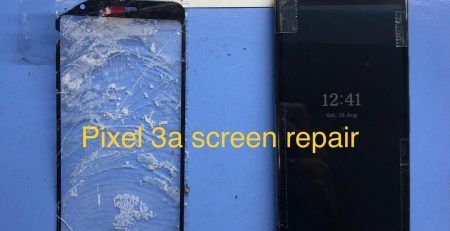
You are a GUI agent. You are given a task and a screenshot of the screen. Output one action in this format:
    pyautogui.click(x=<x>, y=<y>)
    Task: Click on the phone screen
    This screenshot has height=231, width=450.
    Given the screenshot: What is the action you would take?
    pyautogui.click(x=98, y=211)